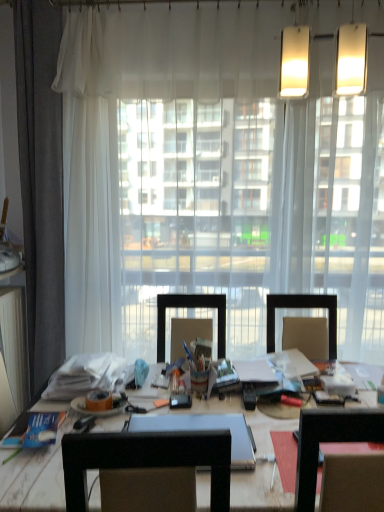
Question: Is wooden desk at center spatially inside orange matte adhesive tape at center, or outside of it?

Choices:
 (A) outside
 (B) inside

Answer: (A)

Question: Considering the positions of wooden desk at center and orange matte adhesive tape at center in the image, is wooden desk at center wider or thinner than orange matte adhesive tape at center?

Choices:
 (A) thin
 (B) wide

Answer: (B)

Question: Considering the real-world distances, which object is farthest from the orange matte adhesive tape at center?

Choices:
 (A) blue paper book at lower left
 (B) wooden desk at center

Answer: (B)

Question: Which of these objects is positioned farthest from the wooden desk at center?

Choices:
 (A) orange matte adhesive tape at center
 (B) blue paper book at lower left

Answer: (A)